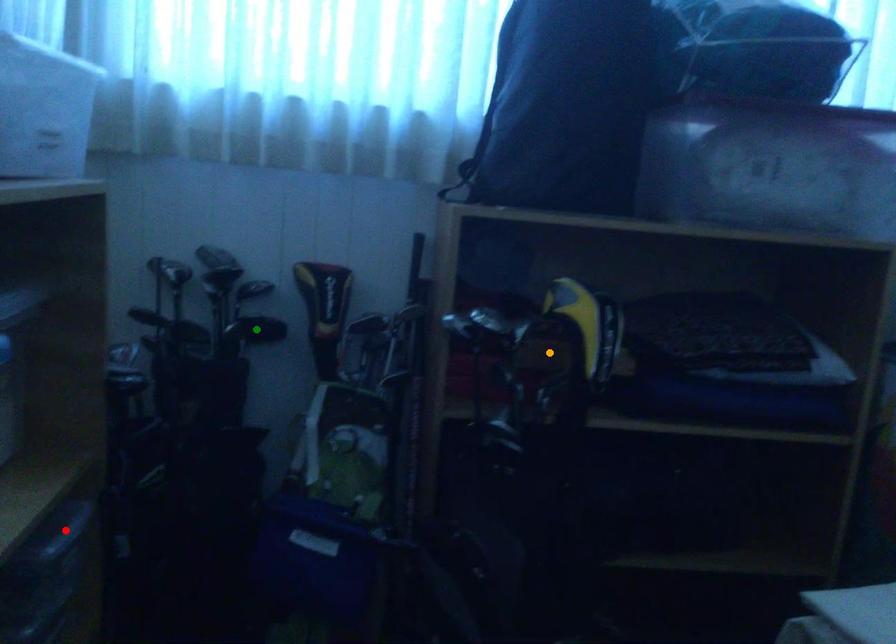
Order these from nearest to farthest:
A) red point
B) green point
C) orange point

1. red point
2. orange point
3. green point